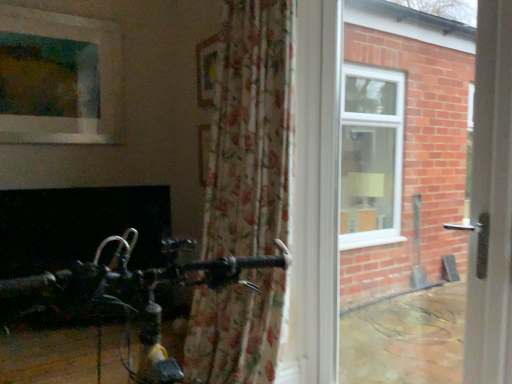
Find the location of `free spot above matte glass window at upper left (from a real-world perspective)`. free spot above matte glass window at upper left (from a real-world perspective) is located at coordinates (60, 8).